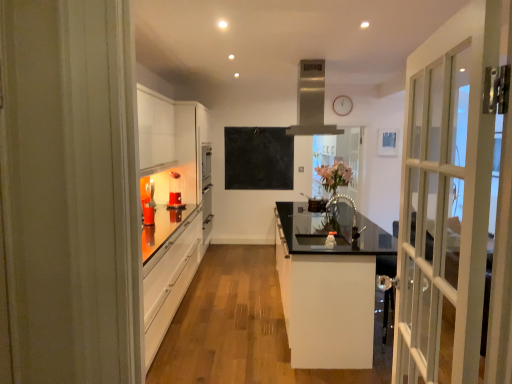
Question: Should I look upward or downward to see satin silver exhaust hood at upper center?

Choices:
 (A) down
 (B) up

Answer: (B)

Question: From the image's perspective, is pink floral bouquet at center above white wooden clock at upper center?

Choices:
 (A) no
 (B) yes

Answer: (A)

Question: Is pink floral bouquet at center taller than white wooden clock at upper center?

Choices:
 (A) no
 (B) yes

Answer: (B)

Question: From a real-world perspective, is pink floral bouquet at center on white wooden clock at upper center?

Choices:
 (A) yes
 (B) no

Answer: (B)

Question: Can you confirm if pink floral bouquet at center is shorter than white wooden clock at upper center?

Choices:
 (A) yes
 (B) no

Answer: (B)

Question: Is the surface of pink floral bouquet at center in direct contact with white wooden clock at upper center?

Choices:
 (A) yes
 (B) no

Answer: (B)

Question: Can you confirm if pink floral bouquet at center is positioned to the right of white wooden clock at upper center?

Choices:
 (A) no
 (B) yes

Answer: (A)

Question: Does matte orange glass at left have a lesser height compared to black matte chalkboard at center?

Choices:
 (A) yes
 (B) no

Answer: (A)

Question: Is matte orange glass at left completely or partially outside of black matte chalkboard at center?

Choices:
 (A) no
 (B) yes

Answer: (B)

Question: Does matte orange glass at left lie behind black matte chalkboard at center?

Choices:
 (A) yes
 (B) no

Answer: (B)

Question: Can you confirm if matte orange glass at left is bigger than black matte chalkboard at center?

Choices:
 (A) no
 (B) yes

Answer: (A)

Question: Can you confirm if matte orange glass at left is positioned to the right of black matte chalkboard at center?

Choices:
 (A) no
 (B) yes

Answer: (A)

Question: From the image's perspective, is matte orange glass at left below black matte chalkboard at center?

Choices:
 (A) yes
 (B) no

Answer: (A)

Question: Is satin silver exhaust hood at upper center bigger than pink floral bouquet at center?

Choices:
 (A) no
 (B) yes

Answer: (B)